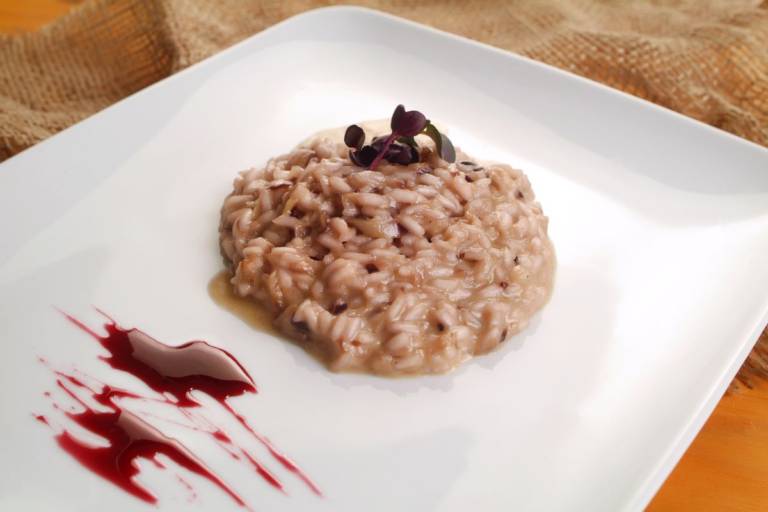
Identify the location of square shaped white plate. The image size is (768, 512). (531, 359).